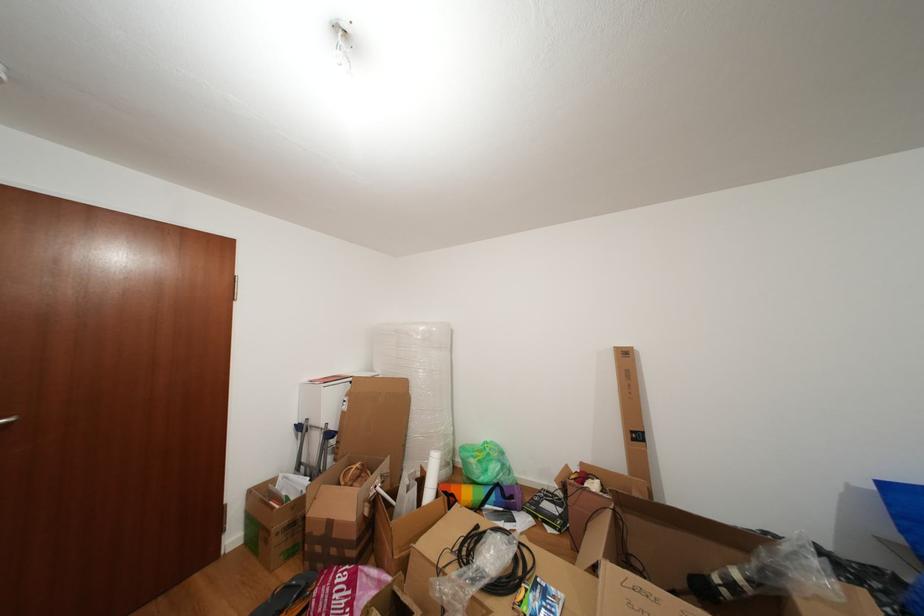
Where would you lift the large open box? Please return your answer as a coordinate pair (x, y).

(694, 557)